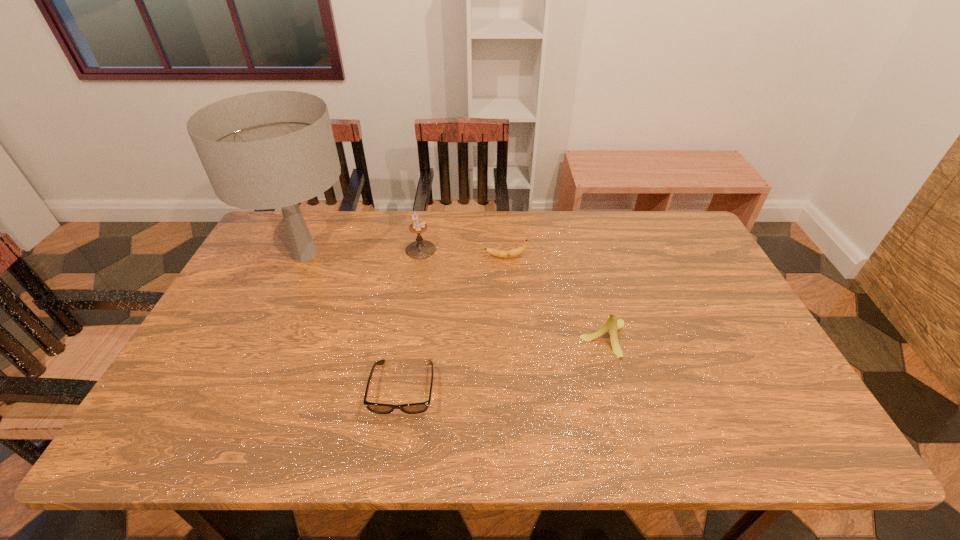
Identify the location of free spot between the leftmost object and the fourth object from left to right. The height and width of the screenshot is (540, 960). (405, 256).

Identify the location of unoccupied area between the nearer banana and the shortest object. This screenshot has width=960, height=540. (504, 363).

At what (x,y) coordinates should I click in order to perform the action: click on empty location between the nearer banana and the second shortest object. Please return your answer as a coordinate pair (x, y). Looking at the image, I should click on (555, 298).

At what (x,y) coordinates should I click in order to perform the action: click on free space between the farther banana and the leftmost object. Please return your answer as a coordinate pair (x, y). The image size is (960, 540). Looking at the image, I should click on (405, 256).

Image resolution: width=960 pixels, height=540 pixels. I want to click on empty space between the farther banana and the nearer banana, so click(555, 298).

Identify which object is the closest to the second tallest object. Please provide its 2D coordinates. Your answer should be formatted as a tuple, i.e. [(x, y)], where the tuple contains the x and y coordinates of a point satisfying the conditions above.

[(272, 149)]

The height and width of the screenshot is (540, 960). I want to click on the third closest object relative to the tallest object, so (514, 252).

Locate an element on the screen. The image size is (960, 540). vacant space that satisfies the following two spatial constraints: 1. on the front-facing side of the tallest object; 2. on the left side of the rightmost object is located at coordinates (267, 339).

Identify the location of free region that satisfies the following two spatial constraints: 1. on the front-facing side of the nearer banana; 2. on the right side of the lampshade. The width and height of the screenshot is (960, 540). (267, 339).

Locate an element on the screen. This screenshot has width=960, height=540. free region that satisfies the following two spatial constraints: 1. on the peel of the taller banana from the top; 2. on the right side of the left banana is located at coordinates (511, 339).